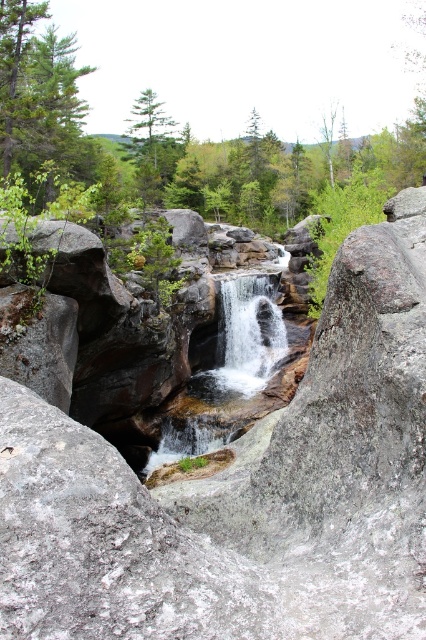
Question: Which point is closer to the camera?

Choices:
 (A) green matte tree at upper left
 (B) gray rough rock at center

Answer: (B)

Question: Is smooth rock waterfall at center smaller than green matte tree at upper center?

Choices:
 (A) no
 (B) yes

Answer: (B)

Question: Which of these objects is positioned farthest from the green matte tree at upper center?

Choices:
 (A) smooth rock waterfall at center
 (B) white frothy water at center
 (C) green matte tree at upper left

Answer: (A)

Question: Does green matte tree at upper left have a lesser width compared to smooth rock waterfall at center?

Choices:
 (A) yes
 (B) no

Answer: (B)

Question: Which point is closer to the camera?

Choices:
 (A) green matte tree at upper left
 (B) white frothy water at center

Answer: (B)

Question: Can you confirm if green matte tree at upper left is wider than smooth rock waterfall at center?

Choices:
 (A) no
 (B) yes

Answer: (B)